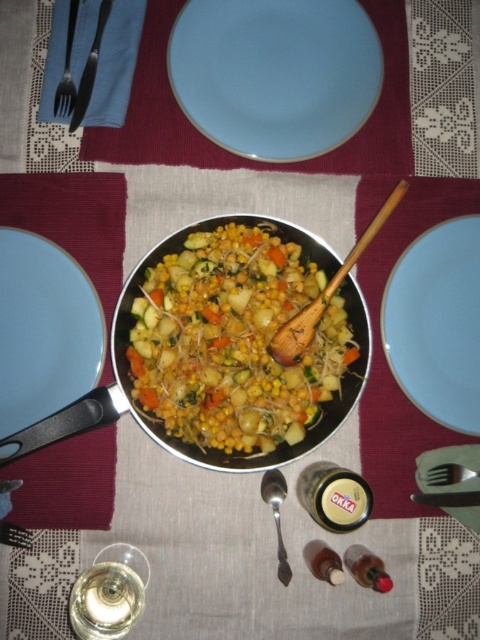
Based on the photo, you are looking at the table setting from above. There are two points marked on the tablecloth, one at point coordinates point (37, 358) and another at point coordinates point (78, 102). Which of these two points is closer to you as you view the table from above?

Point (37, 358) is closer to the camera than point (78, 102).

You are a guest at this table and want to reach for your utensils. Which item is closer to you between the blue matte plate at upper left and the metallic fork at upper left?

The blue matte plate at upper left is closer to you than the metallic fork at upper left.

You are a guest sitting at the table and want to reach for the glass of water located at point (x=283, y=424). There is another glass at point (x=278, y=557). Which glass is closer to you?

Point (x=283, y=424) is in front of point (x=278, y=557), so the glass at point (x=283, y=424) is closer to you.